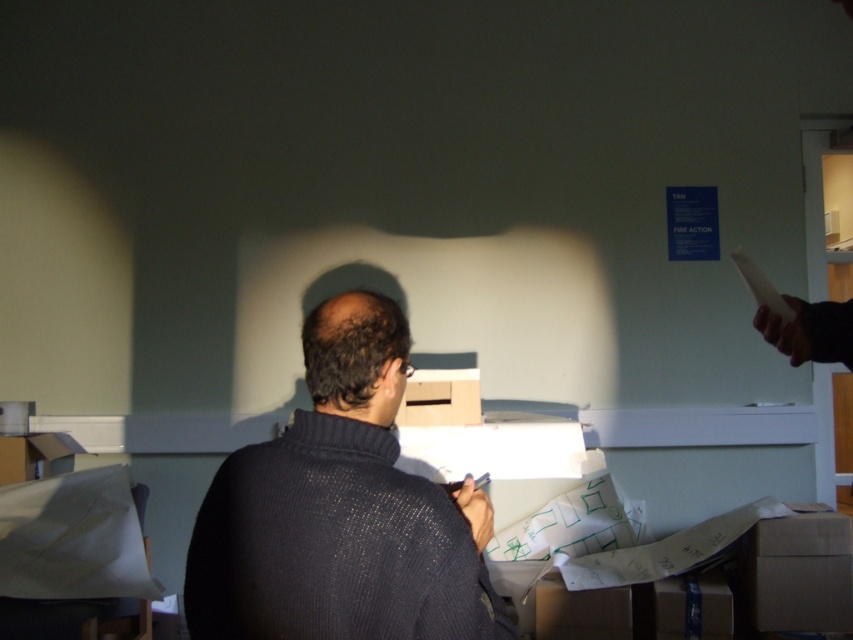
Question: Which point appears closest to the camera in this image?

Choices:
 (A) click(x=468, y=380)
 (B) click(x=225, y=602)

Answer: (B)

Question: Does dark knit sweater at center appear under cardboard box at lower right?

Choices:
 (A) no
 (B) yes

Answer: (A)

Question: Does dark knit sweater at center come in front of matte cardboard box at center?

Choices:
 (A) yes
 (B) no

Answer: (A)

Question: Which of these objects is positioned closest to the matte cardboard box at center?

Choices:
 (A) cardboard box at lower right
 (B) dark knit sweater at center

Answer: (A)

Question: Which of the following is the farthest from the observer?

Choices:
 (A) (752, 611)
 (B) (460, 396)
 (C) (305, 573)

Answer: (B)

Question: Can you confirm if dark knit sweater at center is smaller than cardboard box at lower right?

Choices:
 (A) no
 (B) yes

Answer: (A)